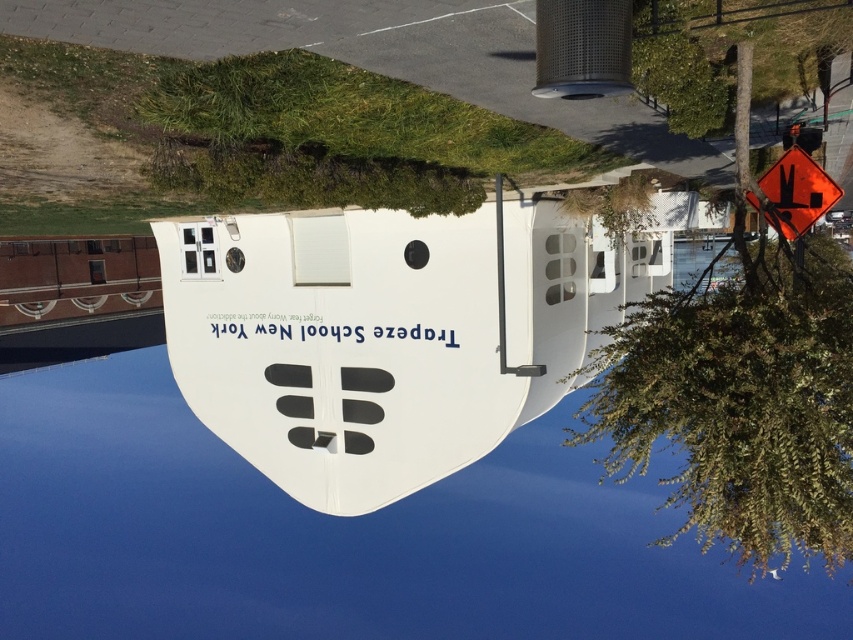
Does point (173, 349) come closer to viewer compared to point (784, 193)?

That is False.

Between white matte boat at center and orange reflective diamond at upper right, which one is positioned lower?

white matte boat at center is lower down.

Is point (497, 392) positioned after point (781, 182)?

Yes, point (497, 392) is farther from viewer.

Identify the location of white matte boat at center. This screenshot has height=640, width=853. (393, 332).

Can you confirm if blue glossy water at center is bigger than orange reflective diamond at upper right?

Yes, blue glossy water at center is bigger than orange reflective diamond at upper right.

What do you see at coordinates (339, 531) in the screenshot? I see `blue glossy water at center` at bounding box center [339, 531].

Locate an element on the screen. The height and width of the screenshot is (640, 853). blue glossy water at center is located at coordinates pyautogui.click(x=339, y=531).

Between blue glossy water at center and white matte boat at center, which one appears on the right side from the viewer's perspective?

Positioned to the right is white matte boat at center.

From the picture: Which is more to the left, blue glossy water at center or white matte boat at center?

blue glossy water at center

Is point (178, 547) farther from camera compared to point (601, 278)?

That is True.

You are a GUI agent. You are given a task and a screenshot of the screen. Output one action in this format:
    pyautogui.click(x=<x>, y=<y>)
    Task: Click on the blue glossy water at center
    
    Given the screenshot: What is the action you would take?
    pyautogui.click(x=339, y=531)